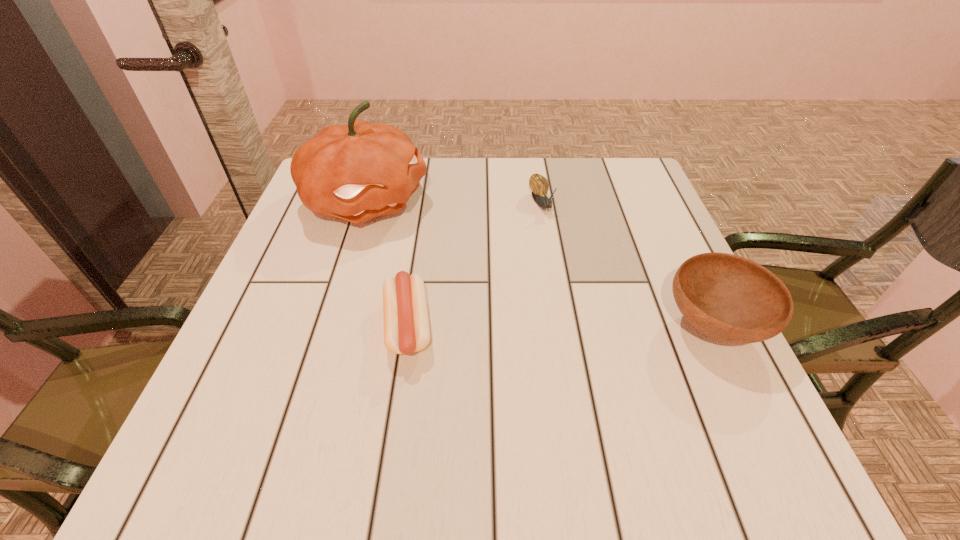
The height and width of the screenshot is (540, 960). In order to click on vacant space located 0.280m on the front-facing side of the escargot in this screenshot , I will do `click(588, 305)`.

This screenshot has height=540, width=960. What are the coordinates of `blank space located on the front-facing side of the escargot` in the screenshot? It's located at (577, 283).

Find the location of a particular element. The image size is (960, 540). vacant region located on the front-facing side of the escargot is located at coordinates (579, 287).

At what (x,y) coordinates should I click in order to perform the action: click on pumpkin that is positioned at the far edge. Please return your answer as a coordinate pair (x, y). The width and height of the screenshot is (960, 540). Looking at the image, I should click on (358, 171).

Where is `escargot that is at the far edge`? This screenshot has height=540, width=960. escargot that is at the far edge is located at coordinates (539, 185).

The width and height of the screenshot is (960, 540). I want to click on object present at the left edge, so click(358, 171).

This screenshot has height=540, width=960. Identify the location of object located in the right edge section of the desktop. (729, 298).

At what (x,y) coordinates should I click in order to perform the action: click on object that is at the far left corner. Please return your answer as a coordinate pair (x, y). This screenshot has width=960, height=540. Looking at the image, I should click on (358, 171).

The height and width of the screenshot is (540, 960). In the image, there is a desktop. In order to click on vacant area at the far edge in this screenshot , I will do [470, 191].

The image size is (960, 540). I want to click on vacant point at the near edge, so click(398, 370).